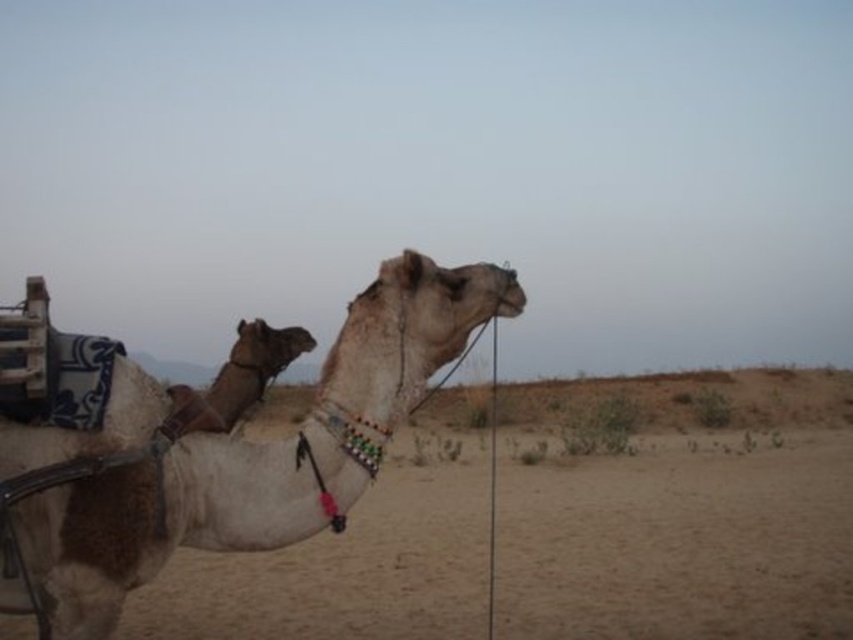
Question: Which of the following is the farthest from the observer?

Choices:
 (A) white matte camel at center
 (B) white sand camel at center

Answer: (B)

Question: Where is white sand camel at center located in relation to white matte camel at center in the image?

Choices:
 (A) below
 (B) above

Answer: (A)

Question: Which point appears farthest from the camera in this image?

Choices:
 (A) (593, 627)
 (B) (334, 506)

Answer: (A)

Question: Observing the image, what is the correct spatial positioning of white sand camel at center in reference to white matte camel at center?

Choices:
 (A) left
 (B) right

Answer: (B)

Question: Among these objects, which one is nearest to the camera?

Choices:
 (A) white sand camel at center
 (B) white matte camel at center

Answer: (B)

Question: Is white sand camel at center below white matte camel at center?

Choices:
 (A) no
 (B) yes

Answer: (B)